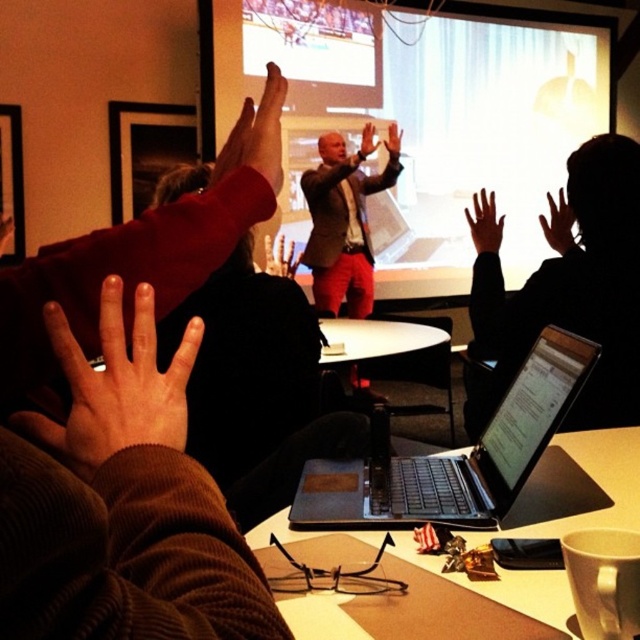
You are an attendee at the presentation and want to quickly grab the black matte laptop at upper center before the speaker notices. Since you are standing next to the brown leather hand at upper left, can you reach it without moving your hand? Explain your reasoning.

The black matte laptop at upper center is to the right of the brown leather hand at upper left. Since you are next to the brown leather hand at upper left, you can reach the black matte laptop at upper center by extending your hand to the right side of the brown leather hand at upper left.

You are standing in the room and see the projector screen at the back and the matte black laptop at center. Which object is closer to the point at coordinates (x=531, y=412)?

The matte black laptop at center is located exactly at the point (x=531, y=412), so it is the closest to that coordinate.

You are organizing a presentation and need to place the black matte laptop at upper center and the brown leather hand at upper left on a desk. If the desk has a maximum width of 1 meter, can both items fit side by side without overlapping?

The black matte laptop at upper center is wider than the brown leather hand at upper left. However, since the desk is 1 meter wide, both items can fit side by side as long as their combined widths do not exceed 1 meter. Unfortunately, without knowing the exact widths of each item, it is impossible to determine if they will fit.